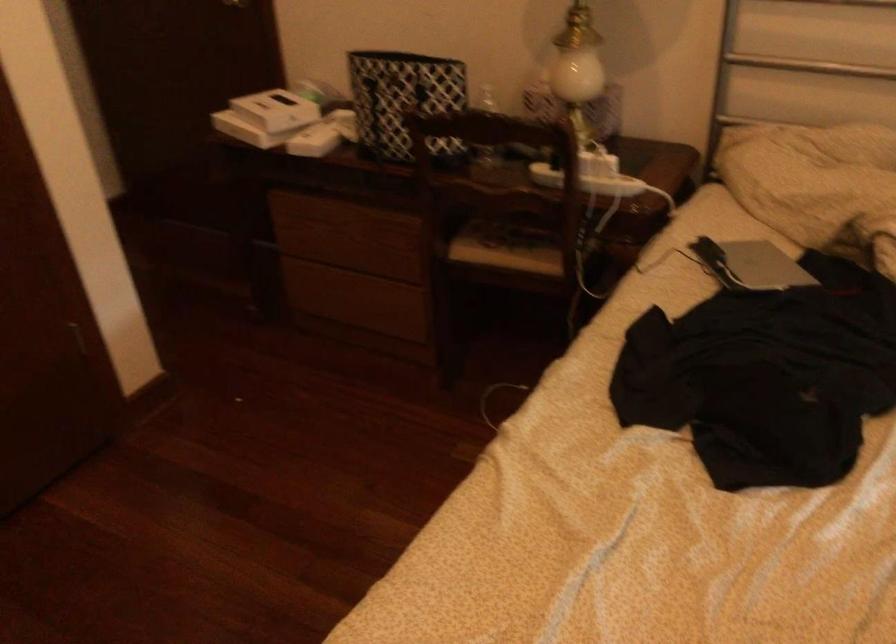
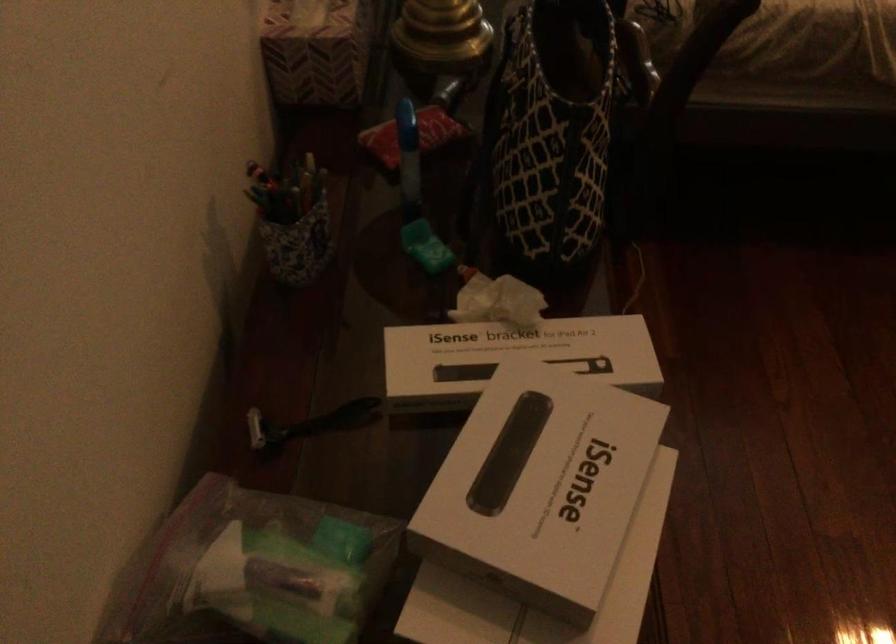
The point at (x=528, y=88) is marked in the first image. Where is the corresponding point in the second image?

(315, 51)